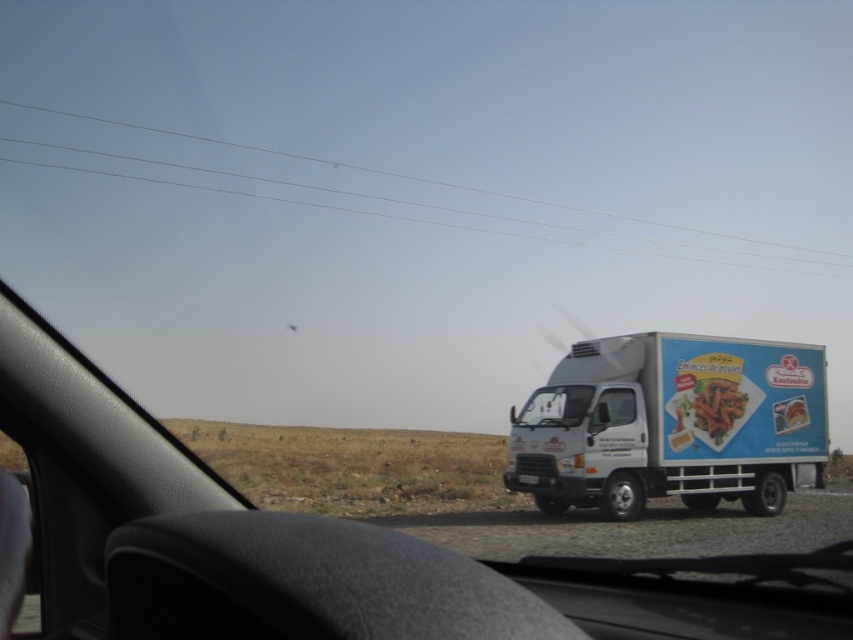
You are driving a car and want to check the road ahead. Which object, the clear wire at upper center or the transparent glass windshield at center, would allow you to see the white truck parked outside better?

The transparent glass windshield at center allows better visibility of the white truck parked outside since it is designed for viewing the road ahead, whereas the clear wire at upper center might obstruct the view due to its possible width.

You are driving a car and see the white truck parked on the gravel road outside your windshield. Where exactly is the smooth plastic carrots at center located in relation to your view?

The smooth plastic carrots at center are located at point [712,406] in your view.

You are a delivery driver who needs to check the items on your truck. You see the smooth plastic carrots at center and the smooth plastic food at center. Which item takes up more space in your truck?

The smooth plastic carrots at center is larger in size than the smooth plastic food at center, so it takes up more space in the truck.